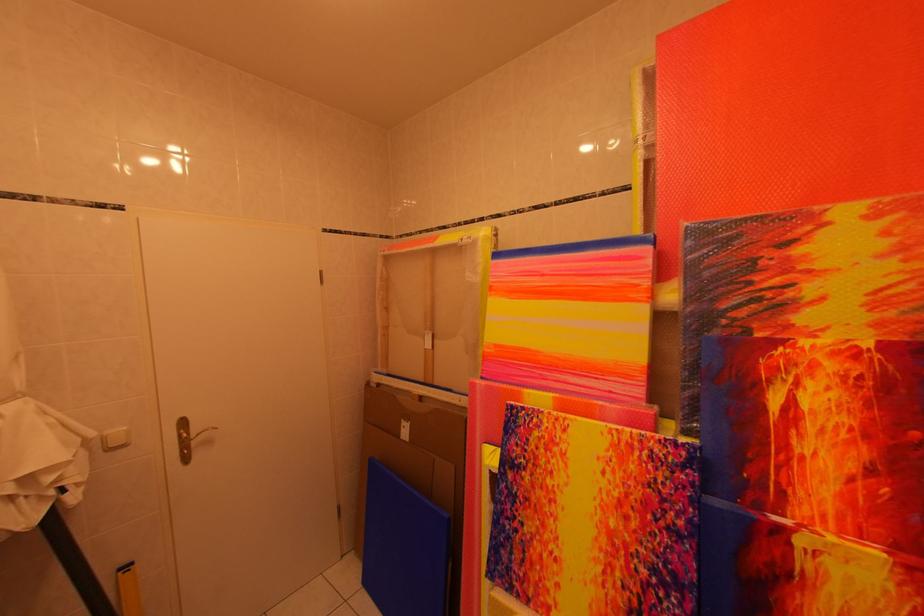
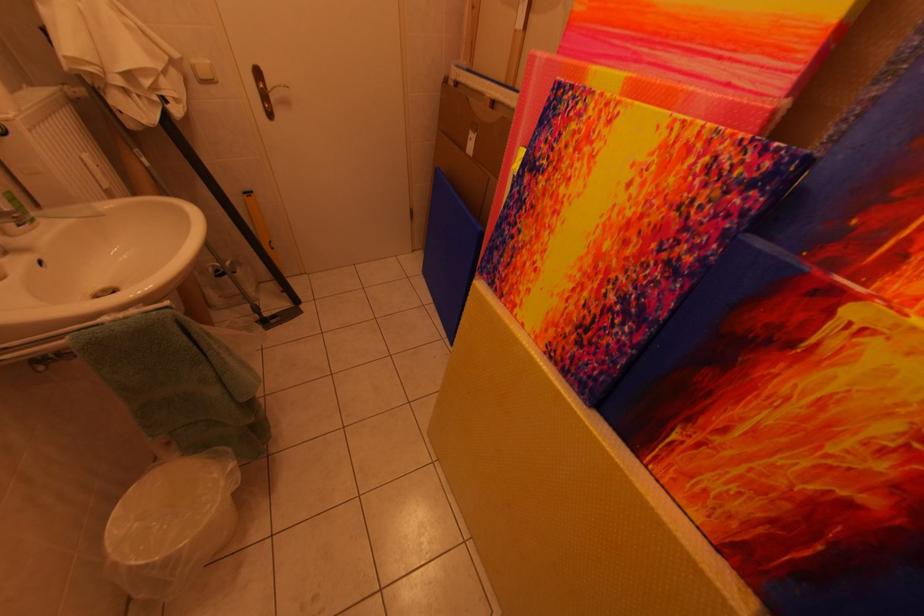
Where in the second image is the point corresponding to point (611, 385) from the first image?

(734, 68)